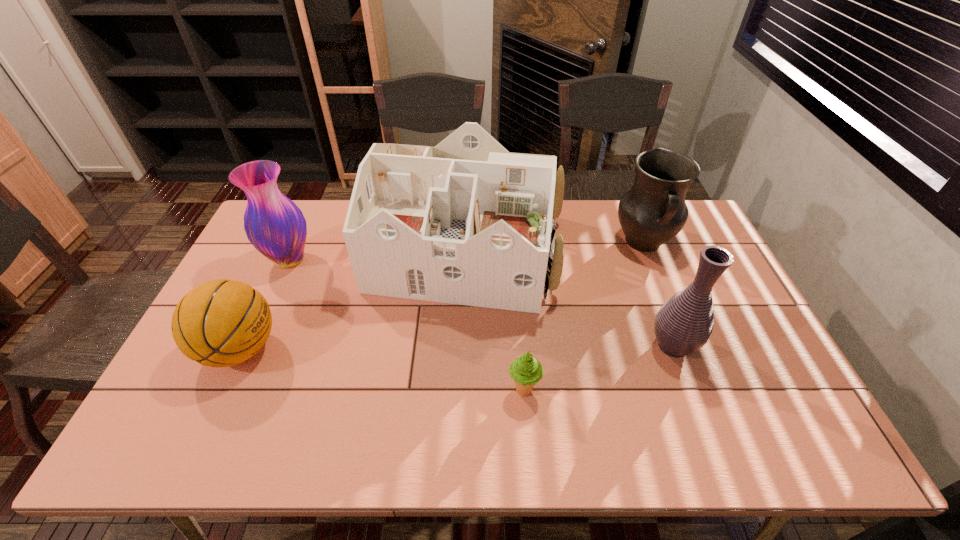
At what (x,y) coordinates should I click in order to perform the action: click on vacant space that satisfies the following two spatial constraints: 1. on the handle side of the pitcher; 2. on the surface of the basketball near the brand logo. Please return your answer as a coordinate pair (x, y). Looking at the image, I should click on (685, 349).

This screenshot has height=540, width=960. What are the coordinates of `free space that satisfies the following two spatial constraints: 1. on the front side of the right vase; 2. on the right side of the dollhouse` in the screenshot? It's located at (465, 346).

In order to click on free spot that satisfies the following two spatial constraints: 1. on the front side of the farther vase; 2. on the surface of the fifth tallest object near the brand logo in this screenshot , I will do `click(250, 349)`.

Where is `vacant position in the image that satisfies the following two spatial constraints: 1. on the surface of the basketball near the brand logo; 2. on the back side of the icecream`? This screenshot has height=540, width=960. vacant position in the image that satisfies the following two spatial constraints: 1. on the surface of the basketball near the brand logo; 2. on the back side of the icecream is located at coordinates (221, 391).

Locate an element on the screen. This screenshot has width=960, height=540. blank area in the image that satisfies the following two spatial constraints: 1. on the back side of the icecream; 2. on the surface of the fifth tallest object near the brand logo is located at coordinates (520, 349).

Locate an element on the screen. vacant space that satisfies the following two spatial constraints: 1. on the handle side of the pitcher; 2. on the surface of the fifth tallest object near the brand logo is located at coordinates (685, 349).